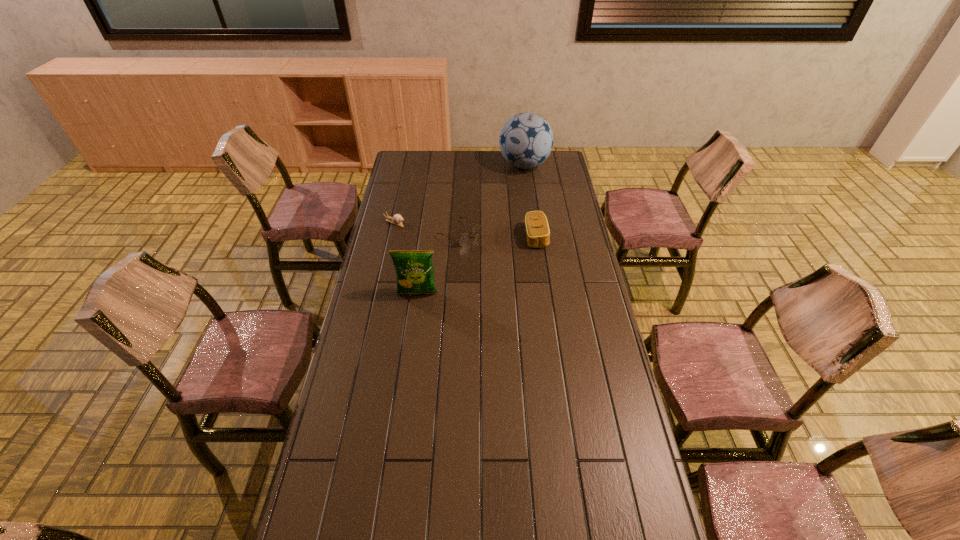
Image resolution: width=960 pixels, height=540 pixels. Identify the location of free space that satisfies the following two spatial constraints: 1. on the front side of the clutch bag; 2. on the zipper side of the sunglasses. (459, 237).